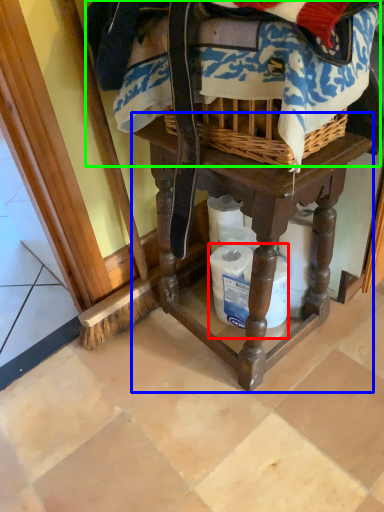
Question: Estimate the real-world distances between objects in this image. Which object is farther from toilet paper (highlighted by a red box), furniture (highlighted by a blue box) or clothing (highlighted by a green box)?

Choices:
 (A) furniture
 (B) clothing

Answer: (B)